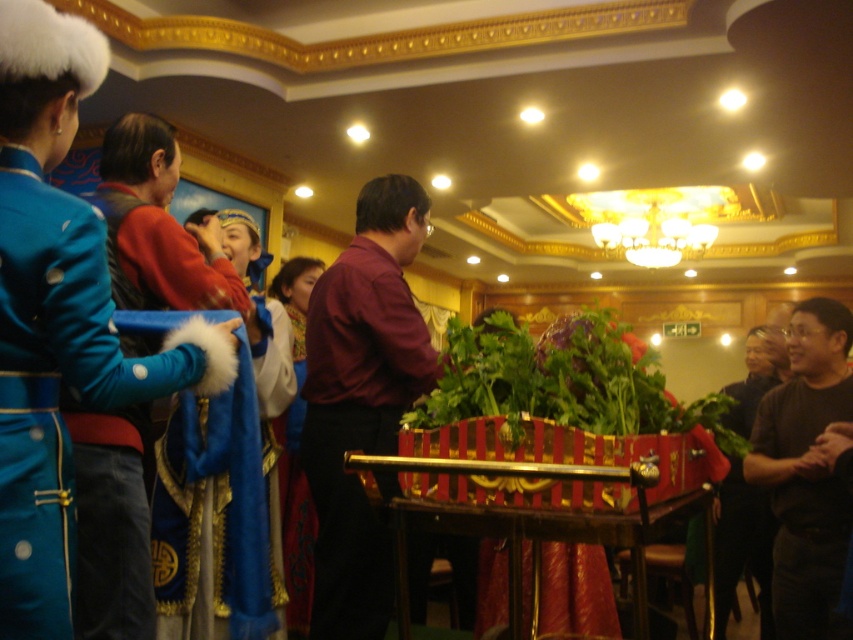
Which is behind, point (117, 445) or point (764, 516)?

Point (764, 516)

Between velvet blue robe at left and dark brown leather jacket at lower right, which one is positioned lower?

Positioned lower is dark brown leather jacket at lower right.

The image size is (853, 640). Describe the element at coordinates (157, 227) in the screenshot. I see `velvet blue robe at left` at that location.

At what (x,y) coordinates should I click in order to perform the action: click on velvet blue robe at left. Please return your answer as a coordinate pair (x, y). Looking at the image, I should click on (157, 227).

Can you confirm if maroon shirt at center is thinner than black matte shirt at right?

Incorrect, maroon shirt at center's width is not less than black matte shirt at right's.

Is point (360, 572) farther from viewer compared to point (791, 356)?

No, it is in front of (791, 356).

Describe the element at coordinates (361, 401) in the screenshot. The width and height of the screenshot is (853, 640). I see `maroon shirt at center` at that location.

Identify the location of maroon shirt at center. This screenshot has height=640, width=853. (361, 401).

Does velvet blue robe at left come in front of black matte shirt at right?

Yes, velvet blue robe at left is closer to the viewer.

Does velvet blue robe at left have a greater height compared to black matte shirt at right?

Correct, velvet blue robe at left is much taller as black matte shirt at right.

Between point (137, 120) and point (840, 378), which one is positioned in front?

Positioned in front is point (137, 120).

I want to click on velvet blue robe at left, so click(157, 227).